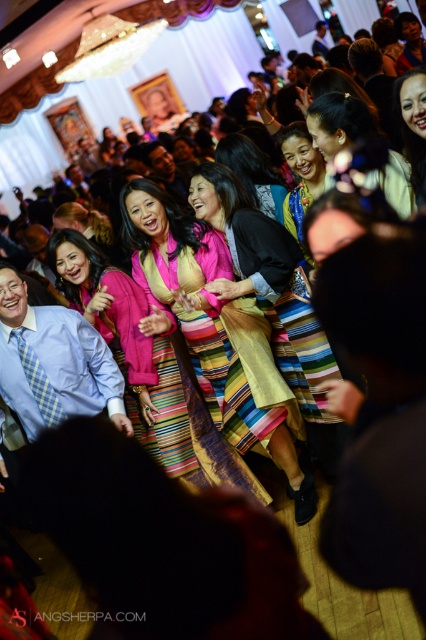
You are a photographer at the event and want to capture a photo that includes both the multicolored woven skirt at center and the multicolored woven dress at center. Which one should you focus on first to ensure both are in the frame?

The multicolored woven skirt at center is located below the multicolored woven dress at center, so you should focus on the multicolored woven dress at center first to ensure both are in the frame.

In the image of the lively indoor gathering with white curtains and a chandelier, where is the matte pink fabric dress at center located in terms of coordinates?

The matte pink fabric dress at center is located at point coordinates of (129,348).

You are at a social event and want to take a photo of the matte pink fabric dress at center and the matte yellow dress at center. Since you are standing in front of them, which dress will appear closer to you in the photo?

The matte pink fabric dress at center will appear closer to you in the photo because it is in front of the matte yellow dress at center.